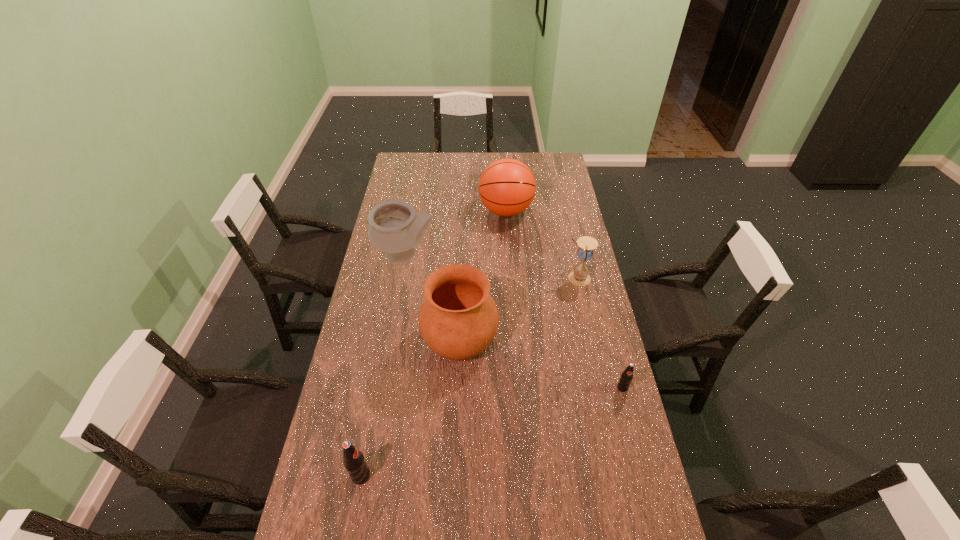
I want to click on free region at the right edge, so click(x=615, y=433).

Find the location of a particular element. The image size is (960, 540). free space between the basketball and the farther pottery is located at coordinates (456, 233).

The height and width of the screenshot is (540, 960). Identify the location of free area in between the left pop and the fifth farthest object. (492, 431).

Locate an element on the screen. The height and width of the screenshot is (540, 960). blank region between the taller pop and the nearer pottery is located at coordinates pos(410,408).

The height and width of the screenshot is (540, 960). In order to click on free space between the farther pottery and the shortest object in this screenshot , I will do `click(514, 321)`.

Locate an element on the screen. free space between the hourglass and the farther pottery is located at coordinates pos(492,267).

Locate an element on the screen. The width and height of the screenshot is (960, 540). empty location between the hourglass and the shorter pop is located at coordinates (600, 333).

Image resolution: width=960 pixels, height=540 pixels. Find the location of `unoccupied area between the hourglass and the farthest object`. unoccupied area between the hourglass and the farthest object is located at coordinates (541, 245).

The image size is (960, 540). What are the coordinates of `vacant area between the farther pottery and the left pop` in the screenshot? It's located at (383, 366).

What are the coordinates of `object that is the fourth closest to the farther pop` in the screenshot? It's located at (394, 228).